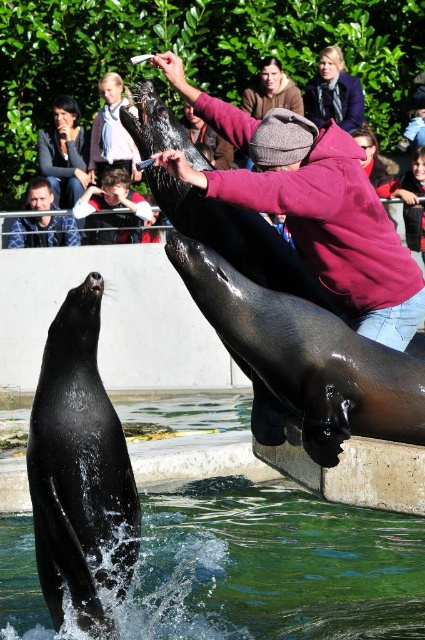
You are a marine biologist observing the scene. You need to locate the shiny black seal at center. What are its coordinates in the image?

The coordinates of the shiny black seal at center are at point (79, 467).

You are a performer at the marine show and need to place a new item between the green liquid water at seal front and the dark blue woolen coat at upper center. Which side should you place it so that it fits without overlapping either object?

Since the green liquid water at seal front is wider than the dark blue woolen coat at upper center, you should place the new item between them on the side of the dark blue woolen coat at upper center to ensure it fits without overlapping.

You are standing at the edge of the pool where the person in the maroon hoodie is. You want to toss a small floating toy to the sea lion that is currently in the water. The green liquid water at seal front is at point 0.886, 0.640. Where should you aim to ensure the toy lands in the water near the sea lion?

You should aim for the green liquid water at seal front located at point (272, 566) to ensure the toy lands near the sea lion in the water.